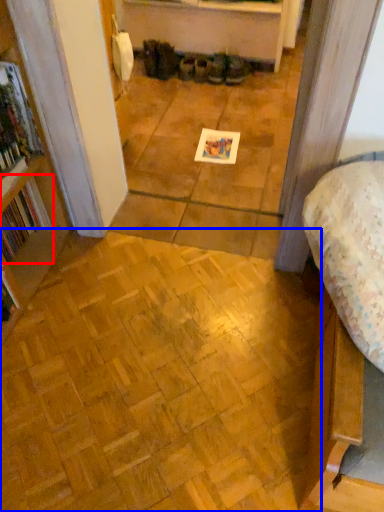
Question: Among these objects, which one is nearest to the camera, book (highlighted by a red box) or plywood (highlighted by a blue box)?

Choices:
 (A) book
 (B) plywood

Answer: (B)